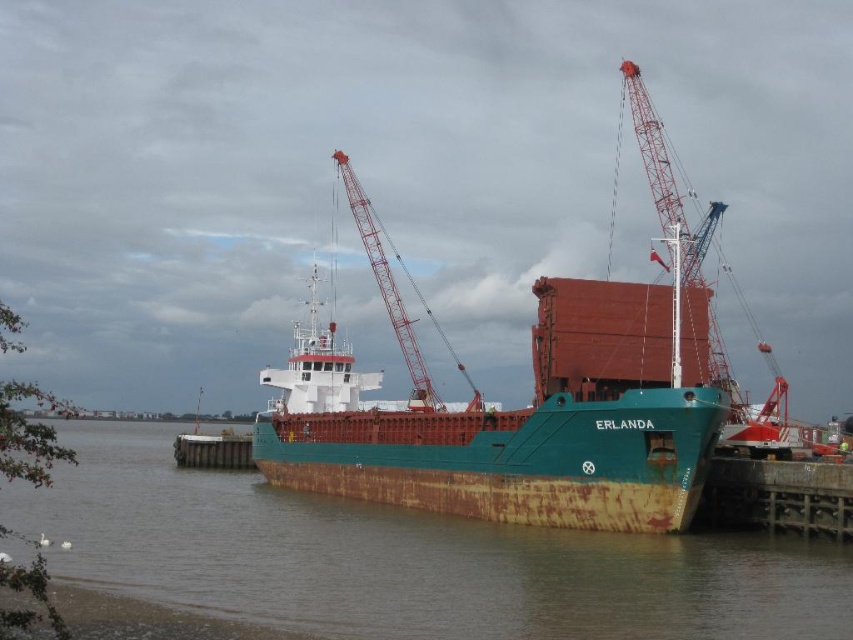
Is rusty metal water at center positioned in front of red metal crane at upper center?

Yes.

I want to click on rusty metal water at center, so click(405, 560).

At what (x,y) coordinates should I click in order to perform the action: click on red metal crane at upper center. Please return your answer as a coordinate pair (x, y). This screenshot has height=640, width=853. Looking at the image, I should click on (666, 180).

Is red metal crane at upper center to the right of rusty metal crane at center from the viewer's perspective?

Yes, red metal crane at upper center is to the right of rusty metal crane at center.

Is point (619, 65) behind point (465, 406)?

That is True.

Identify the location of red metal crane at upper center. This screenshot has height=640, width=853. (666, 180).

Who is more forward, (779,628) or (412,380)?

Point (779,628) is more forward.

Who is positioned more to the right, rusty metal water at center or rusty metal crane at center?

From the viewer's perspective, rusty metal crane at center appears more on the right side.

This screenshot has width=853, height=640. What are the coordinates of `rusty metal water at center` in the screenshot? It's located at (405, 560).

Find the location of a particular element. rusty metal water at center is located at coordinates (405, 560).